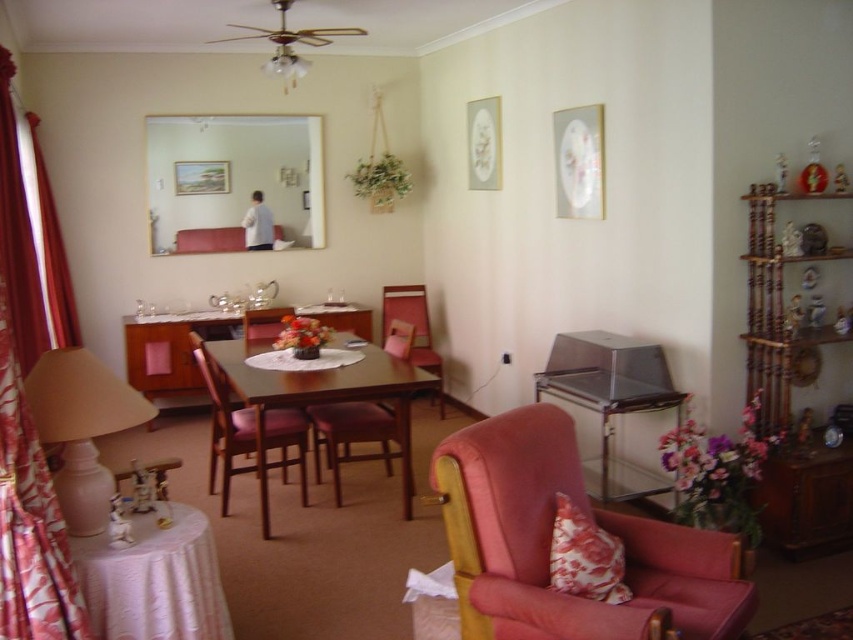
Question: Is matte beige lampshade at lower left wider than floral fabric pillow at lower right?

Choices:
 (A) no
 (B) yes

Answer: (B)

Question: Considering the real-world distances, which object is farthest from the floral fabric pillow at lower right?

Choices:
 (A) matte beige lampshade at lower left
 (B) wooden chair at center
 (C) white glass chandelier at upper center

Answer: (C)

Question: Among these points, which one is nearest to the camera?

Choices:
 (A) (94, 580)
 (B) (251, 472)
 (C) (416, 348)
 (D) (552, 420)

Answer: (A)

Question: Is floral fabric pillow at lower right thinner than pink fabric chair at center?

Choices:
 (A) yes
 (B) no

Answer: (A)

Question: Does white lace tablecloth at lower left have a greater width compared to white glass chandelier at upper center?

Choices:
 (A) no
 (B) yes

Answer: (B)

Question: Which of these objects is positioned closest to the white lace tablecloth at lower left?

Choices:
 (A) wooden chair at center
 (B) red satin curtain at left
 (C) velvet pink armchair at center

Answer: (C)